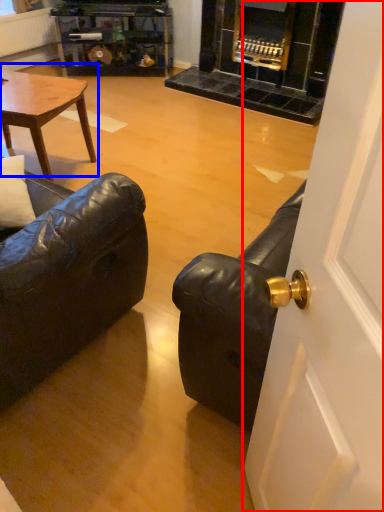
Question: Which object appears farthest to the camera in this image, door (highlighted by a red box) or coffee table (highlighted by a blue box)?

Choices:
 (A) door
 (B) coffee table

Answer: (B)